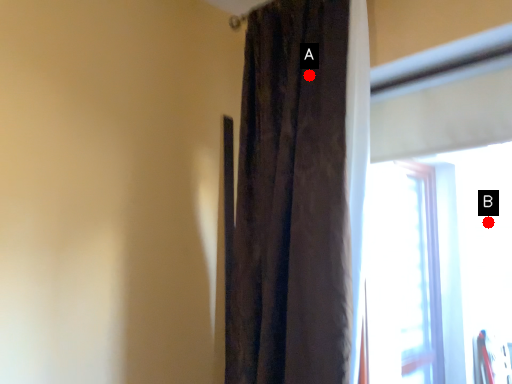
Question: Two points are circled on the image, labeled by A and B beside each circle. Among these points, which one is nearest to the camera?

Choices:
 (A) A is closer
 (B) B is closer

Answer: (A)